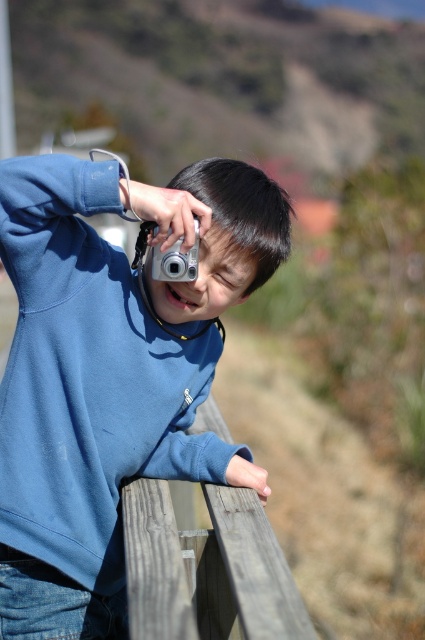
Is point (107, 305) behind point (258, 536)?

Yes, it is behind point (258, 536).

What do you see at coordinates (112, 371) in the screenshot?
I see `blue matte sweatshirt at center` at bounding box center [112, 371].

Locate an element on the screen. The width and height of the screenshot is (425, 640). blue matte sweatshirt at center is located at coordinates (112, 371).

This screenshot has width=425, height=640. Identify the location of blue matte sweatshirt at center. (112, 371).

Is the position of weathered wood fence at lower center more distant than that of silver metallic camera at upper center?

No, weathered wood fence at lower center is closer to the viewer.

Which is behind, point (125, 497) or point (193, 272)?

The point (125, 497) is more distant.

Between point (311, 634) and point (178, 266), which one is positioned behind?

Point (178, 266)

Image resolution: width=425 pixels, height=640 pixels. Find the location of `weathered wood fence at lower center`. weathered wood fence at lower center is located at coordinates (206, 570).

Does blue matte sweatshirt at center appear under silver metallic camera at upper center?

Correct, blue matte sweatshirt at center is located below silver metallic camera at upper center.

Is blue matte sweatshirt at center smaller than silver metallic camera at upper center?

Actually, blue matte sweatshirt at center might be larger than silver metallic camera at upper center.

Does point (23, 214) come farther from viewer compared to point (170, 276)?

No, it is in front of (170, 276).

At what (x,y) coordinates should I click in order to perform the action: click on blue matte sweatshirt at center. Please return your answer as a coordinate pair (x, y). Looking at the image, I should click on (112, 371).